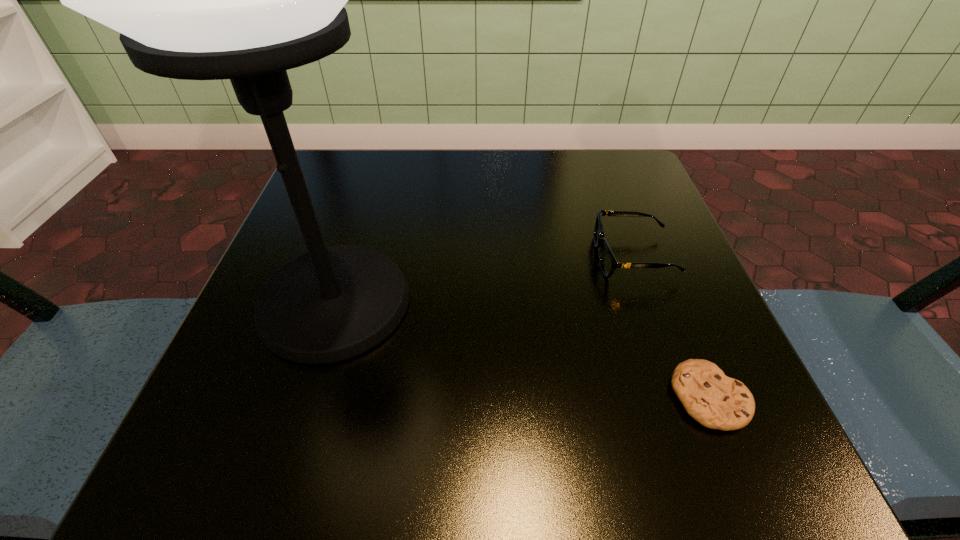
At what (x,y) coordinates should I click in order to perform the action: click on unoccupied position between the shortest object and the leftmost object. Please return your answer as a coordinate pair (x, y). Looking at the image, I should click on (522, 350).

Where is `unoccupied position between the table lamp and the shortest object`? This screenshot has width=960, height=540. unoccupied position between the table lamp and the shortest object is located at coordinates (522, 350).

The width and height of the screenshot is (960, 540). I want to click on empty space that is in between the second shortest object and the cookie, so click(x=672, y=327).

Locate an element on the screen. unoccupied position between the table lamp and the cookie is located at coordinates (522, 350).

Find the location of a particular element. empty space that is in between the second shortest object and the table lamp is located at coordinates (484, 280).

The image size is (960, 540). I want to click on free spot between the leftmost object and the sunglasses, so click(484, 280).

At what (x,y) coordinates should I click in order to perform the action: click on vacant point located between the sunglasses and the table lamp. Please return your answer as a coordinate pair (x, y). The height and width of the screenshot is (540, 960). Looking at the image, I should click on (484, 280).

The image size is (960, 540). What are the coordinates of `free point between the sunglasses and the cookie` in the screenshot? It's located at (672, 327).

Find the location of a particular element. The width and height of the screenshot is (960, 540). vacant area between the sunglasses and the cookie is located at coordinates (672, 327).

Where is `object that can be found as the second closest to the leftmost object`? This screenshot has width=960, height=540. object that can be found as the second closest to the leftmost object is located at coordinates (x=716, y=401).